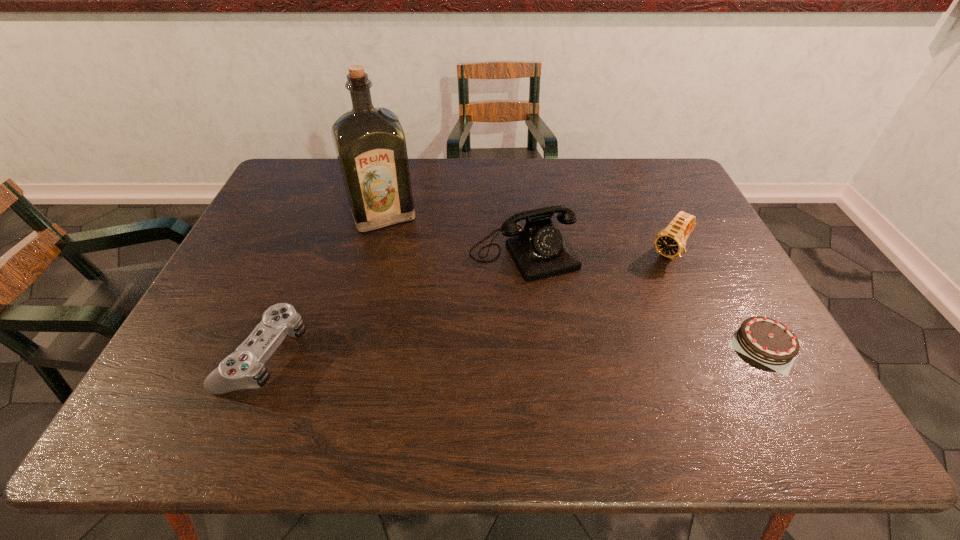
The image size is (960, 540). Identify the location of free space located 0.320m on the face of the watch. (598, 336).

This screenshot has width=960, height=540. Identify the location of vacant space located 0.200m on the face of the watch. (623, 307).

The width and height of the screenshot is (960, 540). Find the location of `vacant space situated on the face of the watch`. vacant space situated on the face of the watch is located at coordinates (609, 324).

Locate an element on the screen. Image resolution: width=960 pixels, height=540 pixels. free space located on the front face of the telephone is located at coordinates (571, 327).

Locate an element on the screen. The height and width of the screenshot is (540, 960). vacant space located on the front face of the telephone is located at coordinates (597, 372).

Where is `free space located on the front face of the telephone`? The width and height of the screenshot is (960, 540). free space located on the front face of the telephone is located at coordinates (607, 387).

Identify the location of object that is at the far edge. Image resolution: width=960 pixels, height=540 pixels. (370, 144).

Find the location of `control that is positioned at the near edge`. control that is positioned at the near edge is located at coordinates (244, 368).

Identify the location of chocolate cake that is at the near edge. (767, 341).

Image resolution: width=960 pixels, height=540 pixels. In order to click on object present at the left edge in this screenshot , I will do `click(244, 368)`.